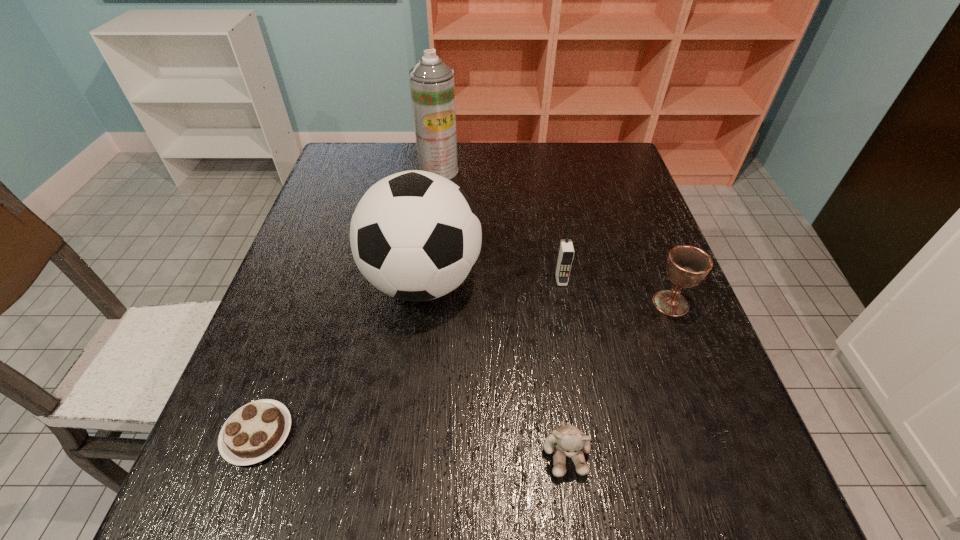
The width and height of the screenshot is (960, 540). Identify the location of free space located 0.100m on the back of the soccer ball. 431,217.

You are a GUI agent. You are given a task and a screenshot of the screen. Output one action in this format:
    pyautogui.click(x=<x>, y=<y>)
    Task: Click on the vacant region located on the front-facing side of the fourth shortest object
    This screenshot has width=960, height=540.
    Given the screenshot: What is the action you would take?
    pyautogui.click(x=588, y=430)

Where is `free space located on the left of the chalice`? free space located on the left of the chalice is located at coordinates coord(469,303).

You are a GUI agent. You are given a task and a screenshot of the screen. Output one action in this format:
    pyautogui.click(x=<x>, y=<y>)
    Task: Click on the free space located on the right of the leftmost object
    
    Given the screenshot: What is the action you would take?
    pyautogui.click(x=443, y=434)

I want to click on object situated at the far edge, so click(432, 86).

Where is `object present at the near edge`? This screenshot has width=960, height=540. object present at the near edge is located at coordinates [568, 440].

Find the location of a particular element. Image resolution: width=960 pixels, height=540 pixels. object present at the left edge is located at coordinates (255, 431).

Locate an element on the screen. This screenshot has height=540, width=960. object that is positioned at the right edge is located at coordinates (687, 265).

This screenshot has height=540, width=960. In the image, there is a desktop. Identify the location of free space at the far edge. (501, 153).

In the image, there is a desktop. Where is `vacant space at the near edge`? The image size is (960, 540). vacant space at the near edge is located at coordinates (366, 521).